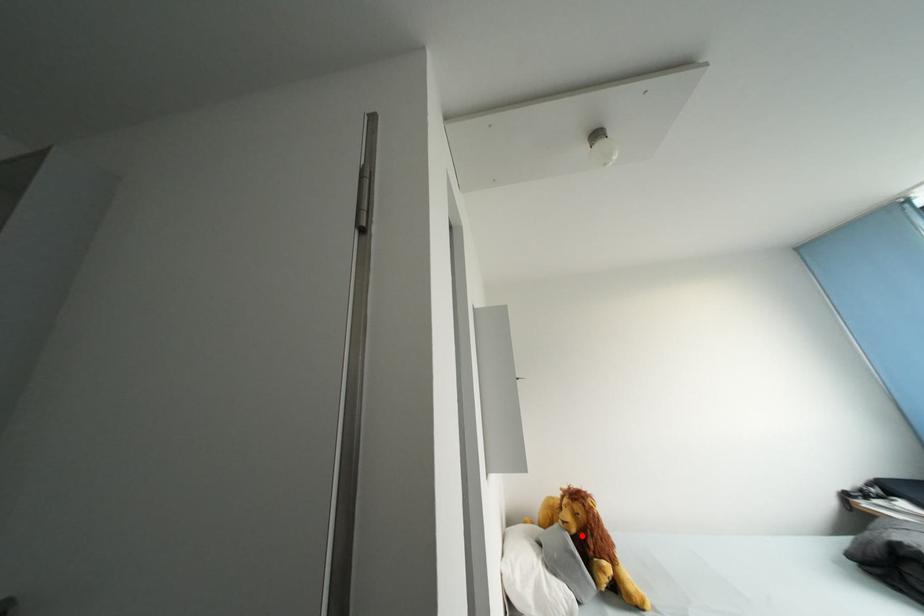
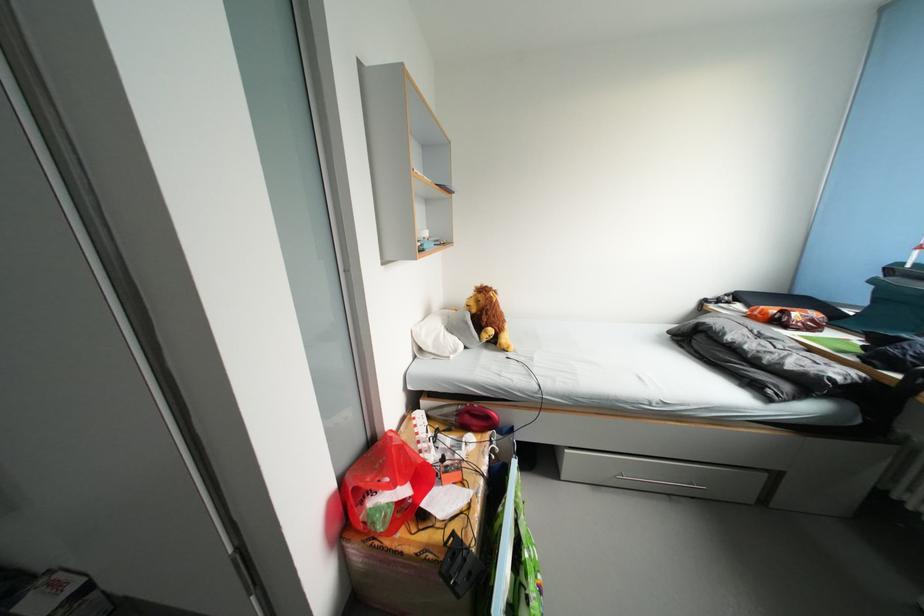
Where in the second image is the point corresponding to the highlighted location from the first image?

(482, 315)